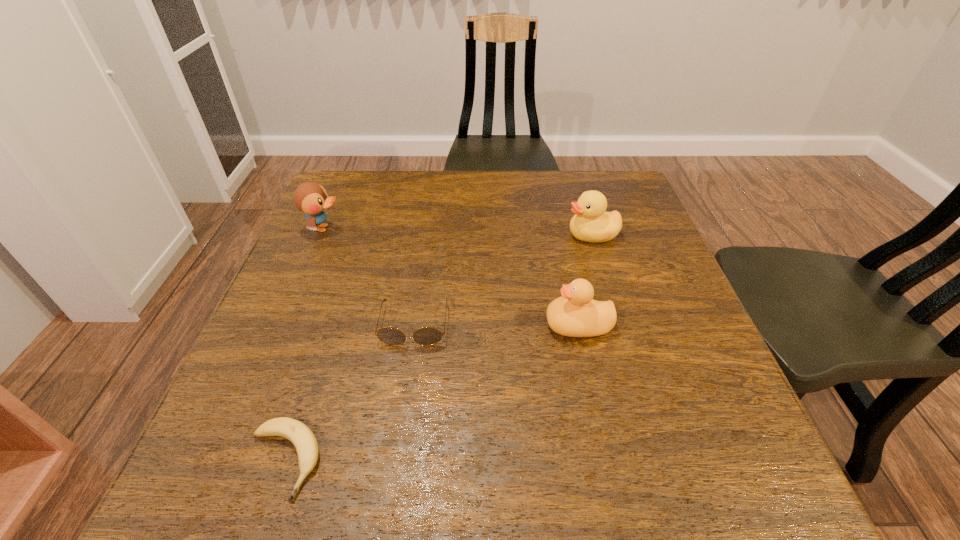
Image resolution: width=960 pixels, height=540 pixels. In order to click on the leftmost duck in this screenshot , I will do `click(311, 198)`.

Identify the location of the nearest duck. Image resolution: width=960 pixels, height=540 pixels. (575, 314).

Identify the location of the second shortest object. (426, 336).

This screenshot has height=540, width=960. I want to click on the third object from right to left, so [426, 336].

This screenshot has height=540, width=960. I want to click on the nearest object, so click(303, 439).

Locate an element on the screen. The image size is (960, 540). the shortest object is located at coordinates (303, 439).

Locate an element on the screen. The height and width of the screenshot is (540, 960). blank space located on the front-facing side of the leftmost duck is located at coordinates (464, 228).

Identify the location of vacant space located on the face of the nearest duck. This screenshot has height=540, width=960. (477, 325).

Where is `free region located on the face of the nearest duck`? free region located on the face of the nearest duck is located at coordinates (492, 325).

The height and width of the screenshot is (540, 960). Identify the location of free space located 0.270m on the face of the nearest duck. (413, 325).